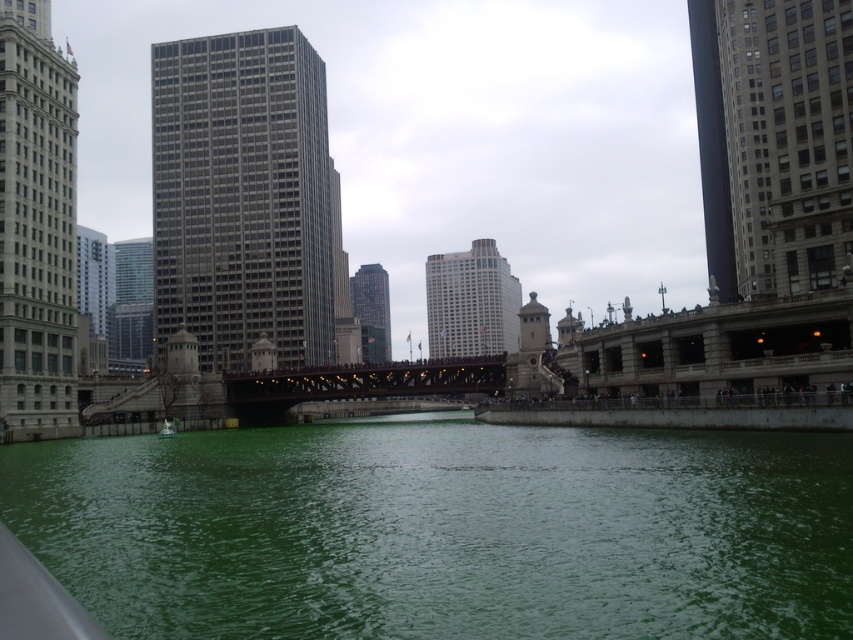
Question: Considering the real-world distances, which object is farthest from the gray stone skyscraper at upper right?

Choices:
 (A) green liquid at center
 (B) green plastic boat at lower left
 (C) white stone tower at left

Answer: (B)

Question: Can you confirm if white stone tower at left is wider than glassy reflective skyscraper at center?

Choices:
 (A) yes
 (B) no

Answer: (B)

Question: Which object is farther from the camera taking this photo?

Choices:
 (A) smooth glass skyscraper at center
 (B) gray stone skyscraper at upper right
 (C) gray glass skyscraper at center
 (D) green plastic boat at lower left

Answer: (A)

Question: Is gray glass skyscraper at center bigger than glassy reflective skyscraper at center?

Choices:
 (A) yes
 (B) no

Answer: (A)

Question: From the image, what is the correct spatial relationship of green liquid at center in relation to glassy reflective skyscraper at center?

Choices:
 (A) below
 (B) above

Answer: (A)

Question: Which point is farther from the camera taking this photo?

Choices:
 (A) click(x=753, y=202)
 (B) click(x=508, y=480)
 (C) click(x=355, y=296)

Answer: (C)